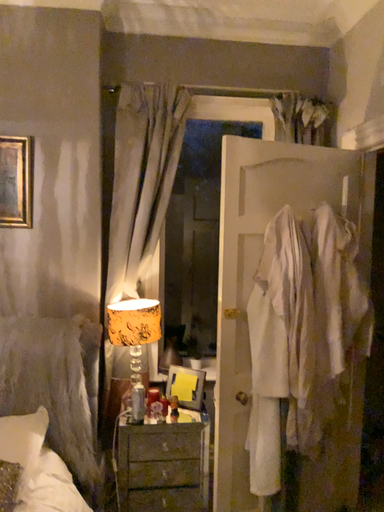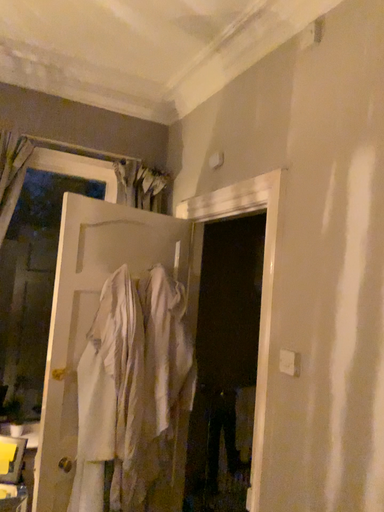
Question: How did the camera likely rotate when shooting the video?

Choices:
 (A) rotated right
 (B) rotated left

Answer: (A)